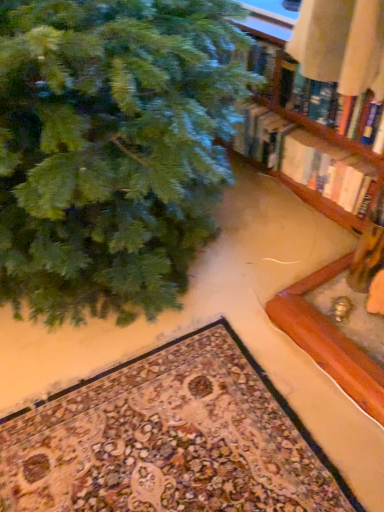
What do you see at coordinates (311, 109) in the screenshot? I see `wooden bookshelf at upper right` at bounding box center [311, 109].

The width and height of the screenshot is (384, 512). What do you see at coordinates (169, 440) in the screenshot? I see `carpeted mat at lower center` at bounding box center [169, 440].

You are a GUI agent. You are given a task and a screenshot of the screen. Output one action in this format:
    pyautogui.click(x=<x>, y=<y>)
    Task: Click on the carpeted mat at lower center
    This screenshot has width=384, height=512.
    Given the screenshot: What is the action you would take?
    point(169,440)

Identify the location of green matte christmas tree at upper left. The height and width of the screenshot is (512, 384). (111, 149).

Where is `wooden bookshelf at upper right`? The width and height of the screenshot is (384, 512). wooden bookshelf at upper right is located at coordinates (311, 109).

Considering the positions of point (297, 453) and point (20, 133), is point (297, 453) closer or farther from the camera than point (20, 133)?

Clearly, point (297, 453) is more distant from the camera than point (20, 133).

Can you confirm if carpeted mat at lower center is thinner than green matte christmas tree at upper left?

Correct, the width of carpeted mat at lower center is less than that of green matte christmas tree at upper left.

At what (x,y) coordinates should I click in order to perform the action: click on mat on the right of the green matte christmas tree at upper left. Please return your answer as a coordinate pair (x, y). Looking at the image, I should click on (169, 440).

Between carpeted mat at lower center and green matte christmas tree at upper left, which one appears on the right side from the viewer's perspective?

From the viewer's perspective, carpeted mat at lower center appears more on the right side.

Is green matte christmas tree at upper left closer to the viewer compared to hardcover book at upper right?

Yes, it is in front of hardcover book at upper right.

Is green matte christmas tree at upper left directly adjacent to hardcover book at upper right?

No.

From a real-world perspective, which object stands above the other?

green matte christmas tree at upper left, from a real-world perspective.

Would you say carpeted mat at lower center is a long distance from hardcover book at upper right?

No.

Is carpeted mat at lower center completely or partially outside of hardcover book at upper right?

Yes.

Could you tell me if carpeted mat at lower center is facing hardcover book at upper right?

No.

Can you confirm if hardcover book at upper right is thinner than wooden bookshelf at upper right?

No, hardcover book at upper right is not thinner than wooden bookshelf at upper right.

From a real-world perspective, does hardcover book at upper right sit lower than wooden bookshelf at upper right?

Yes, from a real-world perspective, hardcover book at upper right is beneath wooden bookshelf at upper right.

Considering the relative positions of hardcover book at upper right and wooden bookshelf at upper right in the image provided, is hardcover book at upper right behind wooden bookshelf at upper right?

Yes, it is behind wooden bookshelf at upper right.

Image resolution: width=384 pixels, height=512 pixels. In order to click on shelf above the hardcover book at upper right (from the image's perspective) in this screenshot , I will do `click(311, 109)`.

From the image's perspective, between wooden bookshelf at upper right and hardcover book at upper right, who is located below?

hardcover book at upper right appears lower in the image.

How different are the orientations of wooden bookshelf at upper right and hardcover book at upper right in degrees?

The angle between the facing direction of wooden bookshelf at upper right and the facing direction of hardcover book at upper right is 0.484 degrees.

Is green matte christmas tree at upper left a part of wooden bookshelf at upper right?

No, green matte christmas tree at upper left is not surrounded by wooden bookshelf at upper right.

Is the position of wooden bookshelf at upper right more distant than that of green matte christmas tree at upper left?

Yes, wooden bookshelf at upper right is further from the camera.

Is wooden bookshelf at upper right oriented away from green matte christmas tree at upper left?

That's not correct — wooden bookshelf at upper right is not looking away from green matte christmas tree at upper left.

Find the location of a particular element. shelf on the right of the carpeted mat at lower center is located at coordinates (311, 109).

Does wooden bookshelf at upper right lie in front of carpeted mat at lower center?

That is False.

Does wooden bookshelf at upper right contain carpeted mat at lower center?

No, carpeted mat at lower center is not inside wooden bookshelf at upper right.

Is wooden bookshelf at upper right to the right of carpeted mat at lower center from the viewer's perspective?

Yes.

Locate an element on the screen. The image size is (384, 512). mat to the right of green matte christmas tree at upper left is located at coordinates (169, 440).

Where is `christmas tree located on the left of hardcover book at upper right`? Image resolution: width=384 pixels, height=512 pixels. christmas tree located on the left of hardcover book at upper right is located at coordinates (111, 149).

From the image, which object appears to be farther from hardcover book at upper right, carpeted mat at lower center or wooden bookshelf at upper right?

The object further to hardcover book at upper right is carpeted mat at lower center.

Estimate the real-world distances between objects in this image. Which object is further from carpeted mat at lower center, green matte christmas tree at upper left or hardcover book at upper right?

hardcover book at upper right lies further to carpeted mat at lower center than the other object.

When comparing their distances from carpeted mat at lower center, does hardcover book at upper right or wooden bookshelf at upper right seem further?

wooden bookshelf at upper right.

Considering their positions, is hardcover book at upper right positioned closer to wooden bookshelf at upper right than green matte christmas tree at upper left?

hardcover book at upper right lies closer to wooden bookshelf at upper right than the other object.

Estimate the real-world distances between objects in this image. Which object is closer to green matte christmas tree at upper left, wooden bookshelf at upper right or hardcover book at upper right?

wooden bookshelf at upper right is positioned closer to the anchor green matte christmas tree at upper left.

Consider the image. Which object lies nearer to the anchor point wooden bookshelf at upper right, green matte christmas tree at upper left or carpeted mat at lower center?

green matte christmas tree at upper left is closer to wooden bookshelf at upper right.

Consider the image. Looking at the image, which one is located further to green matte christmas tree at upper left, hardcover book at upper right or carpeted mat at lower center?

Based on the image, hardcover book at upper right appears to be further to green matte christmas tree at upper left.

Looking at the image, which one is located closer to wooden bookshelf at upper right, carpeted mat at lower center or green matte christmas tree at upper left?

green matte christmas tree at upper left lies closer to wooden bookshelf at upper right than the other object.

Identify the location of book that lies between green matte christmas tree at upper left and carpeted mat at lower center from top to bottom. (327, 169).

Identify the location of shelf between green matte christmas tree at upper left and hardcover book at upper right from left to right. This screenshot has width=384, height=512. (311, 109).

This screenshot has width=384, height=512. I want to click on book between wooden bookshelf at upper right and carpeted mat at lower center from top to bottom, so click(x=327, y=169).

This screenshot has height=512, width=384. I want to click on christmas tree between wooden bookshelf at upper right and carpeted mat at lower center in the vertical direction, so click(x=111, y=149).